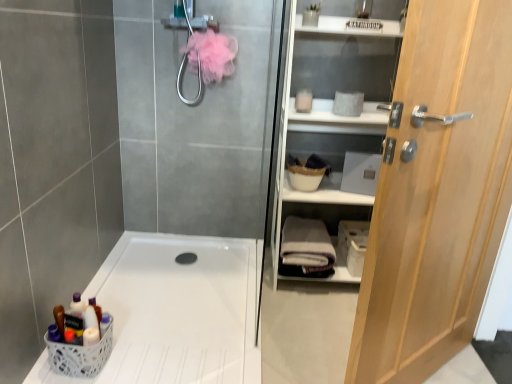
At what (x,y) coordinates should I click in order to perform the action: click on white plastic bath at lower left. Please return your answer as a coordinate pair (x, y). Image resolution: width=512 pixels, height=384 pixels. Looking at the image, I should click on (175, 312).

Where is `white cotton bath towel at center`? The height and width of the screenshot is (384, 512). white cotton bath towel at center is located at coordinates (306, 249).

What do you see at coordinates (306, 249) in the screenshot?
I see `white cotton bath towel at center` at bounding box center [306, 249].

What is the approximate width of white plastic basket at lower left?

The width of white plastic basket at lower left is 7.77 inches.

At what (x,y) coordinates should I click in order to perform the action: click on white matte shelf at right. Please return your answer as a coordinate pair (x, y). Looking at the image, I should click on (331, 119).

Can you tell me how much white plastic basket at lower left and white plastic bath at lower left differ in facing direction?

There is a 90-degree angle between the facing directions of white plastic basket at lower left and white plastic bath at lower left.

Which object is wider, white plastic basket at lower left or white plastic bath at lower left?

white plastic bath at lower left.

From the image's perspective, is white plastic basket at lower left above or below white plastic bath at lower left?

Based on their image positions, white plastic basket at lower left is located beneath white plastic bath at lower left.

Does point (64, 360) come closer to viewer compared to point (386, 30)?

Yes, it is in front of point (386, 30).

Considering the sizes of objects white plastic basket at lower left and white matte shelf at right in the image provided, who is taller, white plastic basket at lower left or white matte shelf at right?

white matte shelf at right is taller.

Between white plastic basket at lower left and white matte shelf at right, which one has larger size?

With larger size is white matte shelf at right.

Which is nearer, [346,274] or [238,272]?

The point [346,274] is closer.

Is white plastic bath at lower left at the back of white matte shelf at right?

No, white matte shelf at right is not facing away from white plastic bath at lower left.

From the image's perspective, is white matte shelf at right located above white plastic bath at lower left?

Indeed, from the image's perspective, white matte shelf at right is shown above white plastic bath at lower left.

Can we say white cotton bath towel at center lies outside white plastic bath at lower left?

That's correct, white cotton bath towel at center is outside of white plastic bath at lower left.

Can you confirm if white cotton bath towel at center is shorter than white plastic bath at lower left?

No.

From a real-world perspective, is white cotton bath towel at center positioned over white plastic bath at lower left based on gravity?

Yes, from a real-world perspective, white cotton bath towel at center is above white plastic bath at lower left.

Would you consider white cotton bath towel at center to be distant from white plastic bath at lower left?

That's not correct — white cotton bath towel at center is a little close to white plastic bath at lower left.

How many degrees apart are the facing directions of light wood door at right and white matte shelf at right?

The angle between the facing direction of light wood door at right and the facing direction of white matte shelf at right is 40.3 degrees.

Is light wood door at right spatially inside white matte shelf at right, or outside of it?

light wood door at right is spatially situated outside white matte shelf at right.

In the scene shown: Is light wood door at right not close to white matte shelf at right?

light wood door at right is near white matte shelf at right, not far away.

Can you see light wood door at right touching white plastic basket at lower left?

light wood door at right is not next to white plastic basket at lower left, and they're not touching.

Is light wood door at right turned away from white plastic basket at lower left?

No, light wood door at right's orientation is not away from white plastic basket at lower left.

In the image, is light wood door at right on the left side or the right side of white plastic basket at lower left?

From the image, it's evident that light wood door at right is to the right of white plastic basket at lower left.

Measure the distance between light wood door at right and white plastic basket at lower left.

A distance of 1.16 meters exists between light wood door at right and white plastic basket at lower left.

Locate an element on the screen. bath that appears below the light wood door at right (from the image's perspective) is located at coordinates (175, 312).

Would you say white plastic bath at lower left is part of light wood door at right's contents?

No.

Is light wood door at right facing towards white plastic bath at lower left?

No, light wood door at right does not turn towards white plastic bath at lower left.

From their relative heights in the image, would you say light wood door at right is taller or shorter than white plastic bath at lower left?

Clearly, light wood door at right is taller compared to white plastic bath at lower left.

Identify the location of basket in front of the white plastic bath at lower left. The height and width of the screenshot is (384, 512). (80, 355).

In the image, there is a white plastic basket at lower left. At what (x,y) coordinates should I click in order to perform the action: click on shelf above it (from the image's perspective). Please return your answer as a coordinate pair (x, y). Looking at the image, I should click on pyautogui.click(x=331, y=119).

Considering their positions, is white cotton bath towel at center positioned closer to white plastic basket at lower left than white plastic bath at lower left?

Based on the image, white plastic bath at lower left appears to be nearer to white plastic basket at lower left.

Which object lies further to the anchor point white plastic bath at lower left, white matte shelf at right or light wood door at right?

light wood door at right is positioned further to the anchor white plastic bath at lower left.

Considering their positions, is light wood door at right positioned further to white matte shelf at right than white plastic basket at lower left?

white plastic basket at lower left lies further to white matte shelf at right than the other object.

From the image, which object appears to be farther from white plastic basket at lower left, light wood door at right or white cotton bath towel at center?

light wood door at right lies further to white plastic basket at lower left than the other object.

Looking at the image, which one is located further to white cotton bath towel at center, white matte shelf at right or light wood door at right?

The object further to white cotton bath towel at center is light wood door at right.

Considering their positions, is white plastic bath at lower left positioned further to white matte shelf at right than white plastic basket at lower left?

white plastic basket at lower left.

Estimate the real-world distances between objects in this image. Which object is further from white plastic basket at lower left, light wood door at right or white plastic bath at lower left?

light wood door at right is further to white plastic basket at lower left.

Considering their positions, is white cotton bath towel at center positioned further to white plastic bath at lower left than light wood door at right?

light wood door at right lies further to white plastic bath at lower left than the other object.

I want to click on bath towel situated between white plastic bath at lower left and white matte shelf at right from left to right, so click(x=306, y=249).

Identify the location of bath between white plastic basket at lower left and light wood door at right in the horizontal direction. pyautogui.click(x=175, y=312).

This screenshot has width=512, height=384. What are the coordinates of `bath between light wood door at right and white cotton bath towel at center from front to back` in the screenshot? It's located at (175, 312).

Locate an element on the screen. Image resolution: width=512 pixels, height=384 pixels. shelf between white plastic bath at lower left and light wood door at right is located at coordinates (331, 119).